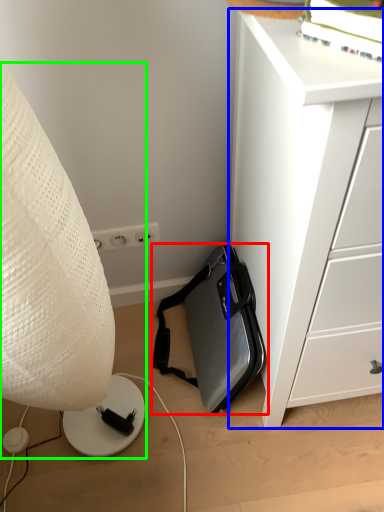
Question: Which object is positioned closest to luggage and bags (highlighted by a red box)? Select from chest of drawers (highlighted by a blue box) and lamp (highlighted by a green box).

Choices:
 (A) chest of drawers
 (B) lamp

Answer: (A)